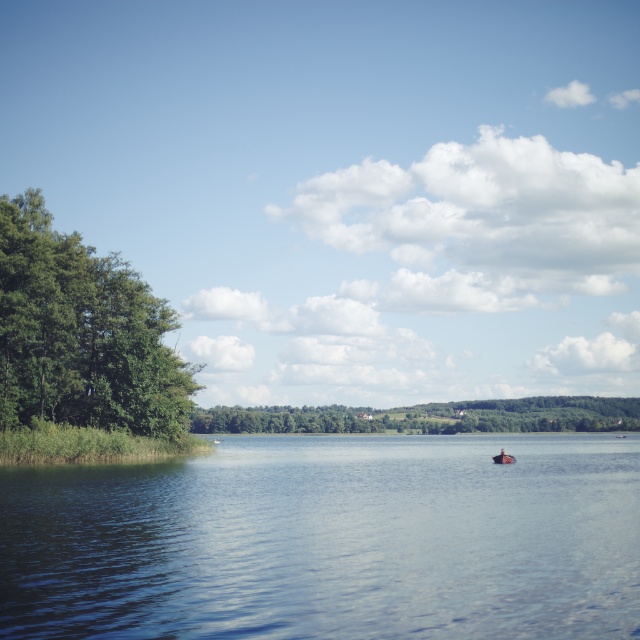
Can you confirm if blue smooth water at center is shorter than green leafy trees at center?

In fact, blue smooth water at center may be taller than green leafy trees at center.

Does blue smooth water at center have a greater width compared to green leafy trees at center?

Incorrect, blue smooth water at center's width does not surpass green leafy trees at center's.

Is point (353, 576) farther from camera compared to point (356, 413)?

No, it is not.

Where is `blue smooth water at center`? The width and height of the screenshot is (640, 640). blue smooth water at center is located at coordinates pyautogui.click(x=330, y=540).

Who is more distant from viewer, (44, 332) or (497, 454)?

The point (497, 454) is more distant.

Between green leafy tree at left and wooden boat at center, which one has more height?

Standing taller between the two is green leafy tree at left.

Is point (134, 420) in front of point (496, 458)?

That is False.

Image resolution: width=640 pixels, height=640 pixels. Identify the location of green leafy tree at left. (81, 333).

Can you confirm if green leafy tree at left is thinner than green leafy trees at center?

Yes.

Can you confirm if green leafy tree at left is wider than green leafy trees at center?

In fact, green leafy tree at left might be narrower than green leafy trees at center.

Between point (124, 323) and point (193, 412), which one is positioned behind?

Point (193, 412)

The image size is (640, 640). What are the coordinates of `green leafy tree at left` in the screenshot? It's located at (81, 333).